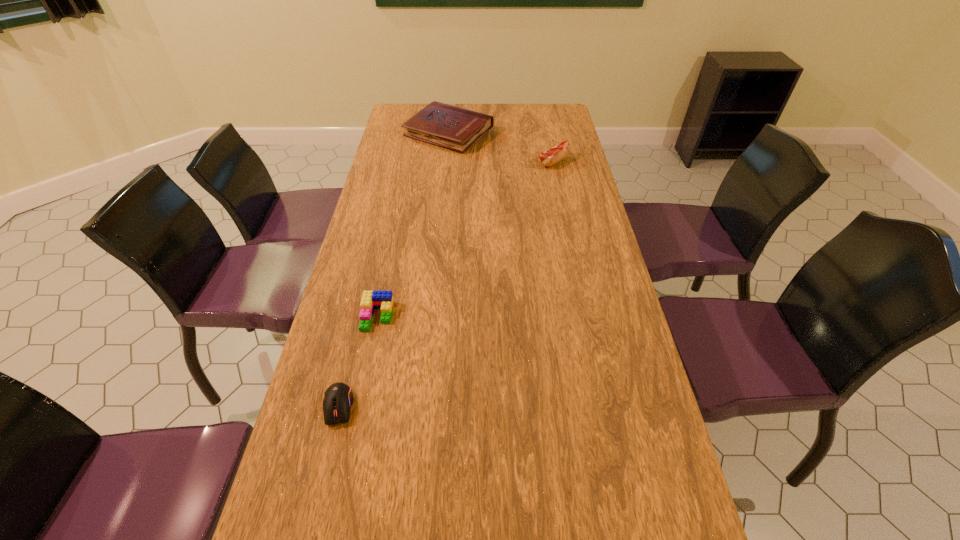
Identify the location of blank region between the second nearest object and the shortest object. The height and width of the screenshot is (540, 960). (358, 361).

Locate an element on the screen. free space between the sausage and the second shortest object is located at coordinates (466, 239).

The image size is (960, 540). I want to click on vacant area that lies between the nearest object and the second shortest object, so click(x=358, y=361).

Image resolution: width=960 pixels, height=540 pixels. Find the location of `vacant space in between the nearest object and the rightmost object`. vacant space in between the nearest object and the rightmost object is located at coordinates 445,284.

Identify the location of free spot between the Lego and the hardback book. The width and height of the screenshot is (960, 540). (413, 225).

Point out which object is positioned as the second nearest to the hardback book. Please provide its 2D coordinates. Your answer should be formatted as a tuple, i.e. [(x, y)], where the tuple contains the x and y coordinates of a point satisfying the conditions above.

[(371, 300)]

What are the coordinates of `object that ranks as the second closest to the hardback book` in the screenshot? It's located at (371, 300).

In order to click on free point that satisfies the following two spatial constraints: 1. on the back side of the sausage; 2. on the right side of the Lego in this screenshot , I will do `click(409, 162)`.

The height and width of the screenshot is (540, 960). What are the coordinates of `vacant position in the image that satisfies the following two spatial constraints: 1. on the front side of the sausage; 2. on the left side of the hardback book` in the screenshot? It's located at (445, 162).

Identify the location of blank area in the image that satisfies the following two spatial constraints: 1. on the back side of the hardback book; 2. on the right side of the Lego. (416, 133).